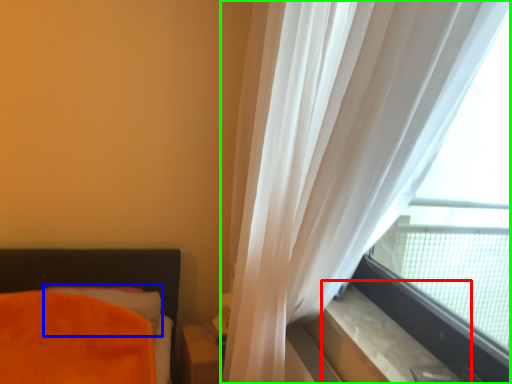
Question: Considering the real-world distances, which object is closest to window sill (highlighted by a red box)? pillow (highlighted by a blue box) or curtain (highlighted by a green box).

Choices:
 (A) pillow
 (B) curtain

Answer: (B)